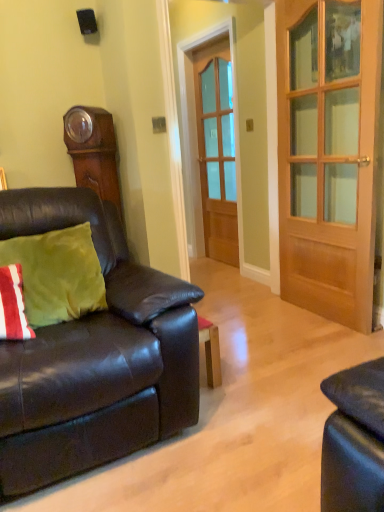
Question: Is matte black couch at left to the right of wooden grandfather clock at upper left from the viewer's perspective?

Choices:
 (A) yes
 (B) no

Answer: (A)

Question: Considering the relative sizes of matte black couch at left and wooden grandfather clock at upper left in the image provided, is matte black couch at left thinner than wooden grandfather clock at upper left?

Choices:
 (A) no
 (B) yes

Answer: (A)

Question: Is matte black couch at left wider than wooden grandfather clock at upper left?

Choices:
 (A) no
 (B) yes

Answer: (B)

Question: Is matte black couch at left oriented away from wooden grandfather clock at upper left?

Choices:
 (A) no
 (B) yes

Answer: (A)

Question: From a real-world perspective, is matte black couch at left located beneath wooden grandfather clock at upper left?

Choices:
 (A) yes
 (B) no

Answer: (A)

Question: Does matte black couch at left appear on the left side of wooden grandfather clock at upper left?

Choices:
 (A) yes
 (B) no

Answer: (B)

Question: Considering the relative sizes of wooden door at center, which is the first door from front to back, and matte black couch at left in the image provided, is wooden door at center, which is the first door from front to back, shorter than matte black couch at left?

Choices:
 (A) yes
 (B) no

Answer: (B)

Question: Can you confirm if wooden door at center, the 2th door from the back, is thinner than matte black couch at left?

Choices:
 (A) yes
 (B) no

Answer: (A)

Question: Does wooden door at center, the 2th door from the back, turn towards matte black couch at left?

Choices:
 (A) yes
 (B) no

Answer: (A)

Question: Is wooden door at center, which is counted as the 2th door, starting from the left, looking in the opposite direction of matte black couch at left?

Choices:
 (A) yes
 (B) no

Answer: (B)

Question: From the image's perspective, is wooden door at center, the 1th door viewed from the right, above matte black couch at left?

Choices:
 (A) yes
 (B) no

Answer: (A)

Question: Is wooden door at center, which is counted as the 2th door, starting from the left, far from matte black couch at left?

Choices:
 (A) no
 (B) yes

Answer: (B)

Question: Is matte black couch at left to the right of black matte speaker at upper center from the viewer's perspective?

Choices:
 (A) no
 (B) yes

Answer: (B)